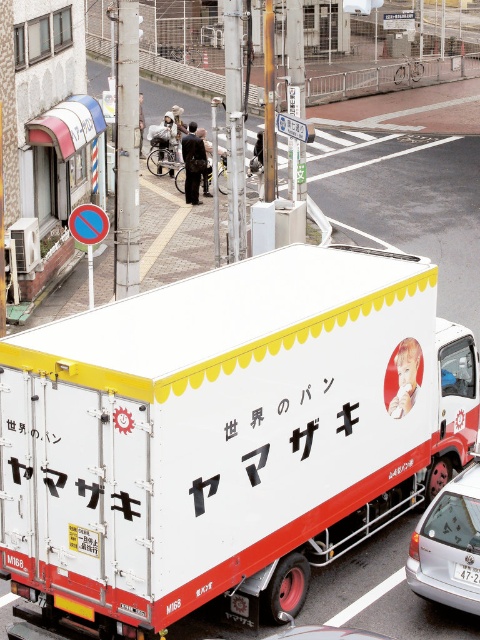
Question: Can you confirm if white matte trailer truck at center is smaller than white plastic license plate at lower right?

Choices:
 (A) no
 (B) yes

Answer: (A)

Question: Estimate the real-world distances between objects in this image. Which object is farther from the white matte trailer truck at center?

Choices:
 (A) white plastic license plate at lower right
 (B) whitematerial/texture at right
 (C) silver metallic sedan at lower right

Answer: (A)

Question: Is white matte trailer truck at center further to camera compared to whitematerial/texture at right?

Choices:
 (A) no
 (B) yes

Answer: (A)

Question: Which object appears closest to the camera in this image?

Choices:
 (A) white plastic license plate at lower right
 (B) silver metallic sedan at lower right

Answer: (B)

Question: From the image, what is the correct spatial relationship of silver metallic sedan at lower right in relation to whitematerial/texture at right?

Choices:
 (A) below
 (B) above

Answer: (A)

Question: Which object appears closest to the camera in this image?

Choices:
 (A) white matte trailer truck at center
 (B) silver metallic sedan at lower right
 (C) white plastic license plate at lower right
 (D) whitematerial/texture at right

Answer: (A)